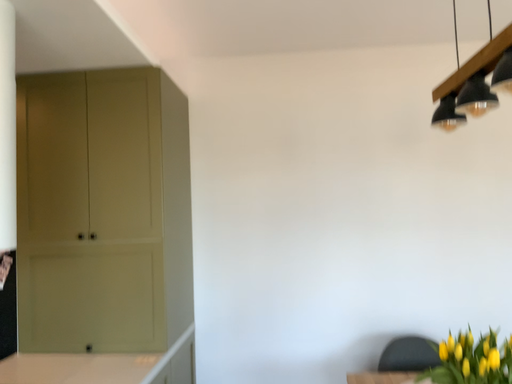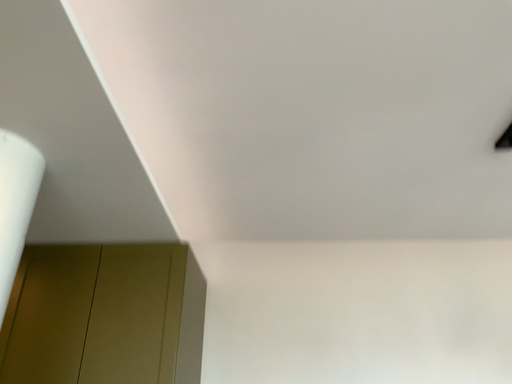
Question: How did the camera likely rotate when shooting the video?

Choices:
 (A) rotated downward
 (B) rotated upward

Answer: (B)